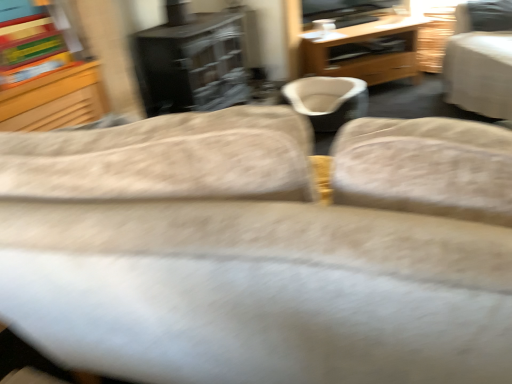
Question: Considering the relative sizes of light gray fabric chair at upper right and wooden desk at center in the image provided, is light gray fabric chair at upper right smaller than wooden desk at center?

Choices:
 (A) no
 (B) yes

Answer: (A)

Question: Does light gray fabric chair at upper right come behind wooden desk at center?

Choices:
 (A) no
 (B) yes

Answer: (A)

Question: From a real-world perspective, does light gray fabric chair at upper right sit lower than wooden desk at center?

Choices:
 (A) no
 (B) yes

Answer: (A)

Question: Are light gray fabric chair at upper right and wooden desk at center making contact?

Choices:
 (A) yes
 (B) no

Answer: (B)

Question: Does light gray fabric chair at upper right have a greater height compared to wooden desk at center?

Choices:
 (A) yes
 (B) no

Answer: (A)

Question: Would you say wooden desk at center is inside or outside light gray fabric chair at upper right?

Choices:
 (A) outside
 (B) inside

Answer: (A)

Question: Based on their sizes in the image, would you say wooden desk at center is bigger or smaller than light gray fabric chair at upper right?

Choices:
 (A) small
 (B) big

Answer: (A)

Question: Considering the positions of wooden desk at center and light gray fabric chair at upper right in the image, is wooden desk at center wider or thinner than light gray fabric chair at upper right?

Choices:
 (A) thin
 (B) wide

Answer: (A)

Question: From their relative heights in the image, would you say wooden desk at center is taller or shorter than light gray fabric chair at upper right?

Choices:
 (A) tall
 (B) short

Answer: (B)

Question: Does point (342, 105) appear closer or farther from the camera than point (410, 41)?

Choices:
 (A) farther
 (B) closer

Answer: (B)

Question: In terms of size, does beige fabric bean bag chair at center appear bigger or smaller than wooden desk at center?

Choices:
 (A) small
 (B) big

Answer: (A)

Question: Would you say beige fabric bean bag chair at center is inside or outside wooden desk at center?

Choices:
 (A) inside
 (B) outside

Answer: (B)

Question: From a real-world perspective, is beige fabric bean bag chair at center physically located above or below wooden desk at center?

Choices:
 (A) below
 (B) above

Answer: (A)

Question: From a real-world perspective, relative to light gray fabric chair at upper right, is beige fabric bean bag chair at center vertically above or below?

Choices:
 (A) above
 (B) below

Answer: (B)

Question: Is beige fabric bean bag chair at center taller or shorter than light gray fabric chair at upper right?

Choices:
 (A) short
 (B) tall

Answer: (A)